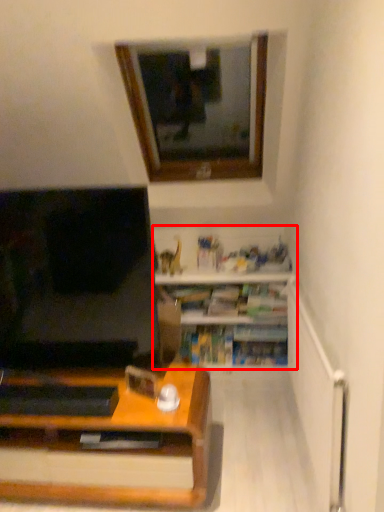
Question: Observing the image, what is the correct spatial positioning of shelf (annotated by the red box) in reference to window?

Choices:
 (A) left
 (B) right

Answer: (B)